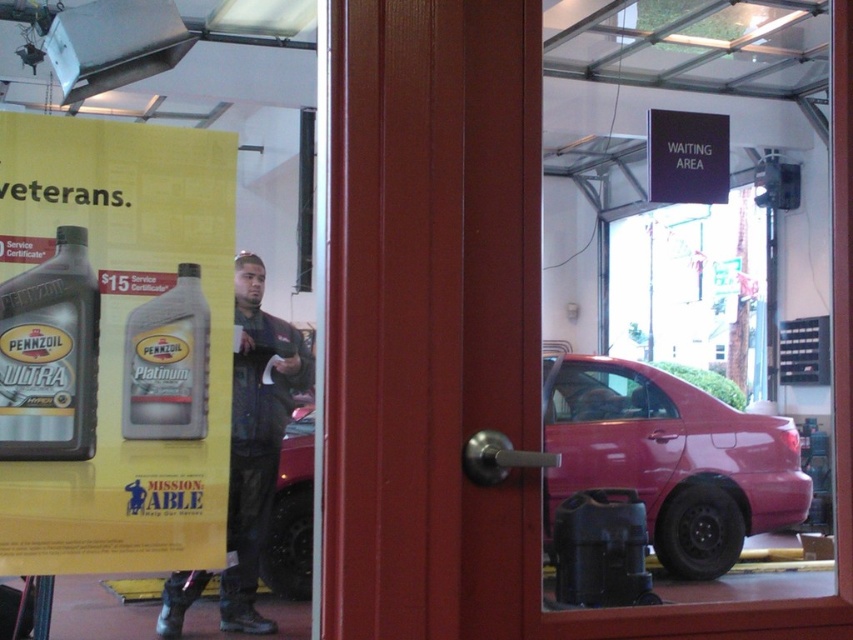
Question: Which point is closer to the camera taking this photo?

Choices:
 (A) (253, 497)
 (B) (207, 544)
 (C) (279, 468)

Answer: (B)

Question: Can you confirm if matte red car at center is positioned above transparent glass door at center?

Choices:
 (A) no
 (B) yes

Answer: (A)

Question: Can you confirm if metallic red car at center is smaller than black plastic sign at upper center?

Choices:
 (A) yes
 (B) no

Answer: (A)

Question: Among these points, which one is nearest to the camera?

Choices:
 (A) (280, 595)
 (B) (312, 496)
 (C) (561, 460)

Answer: (A)

Question: From the image, what is the correct spatial relationship of matte red car at center in relation to black plastic sign at upper center?

Choices:
 (A) above
 (B) below

Answer: (B)

Question: Among these objects, which one is nearest to the camera?

Choices:
 (A) matte red car at center
 (B) black plastic sign at upper center
 (C) metallic red sedan at center
 (D) matte black oil can at left

Answer: (D)